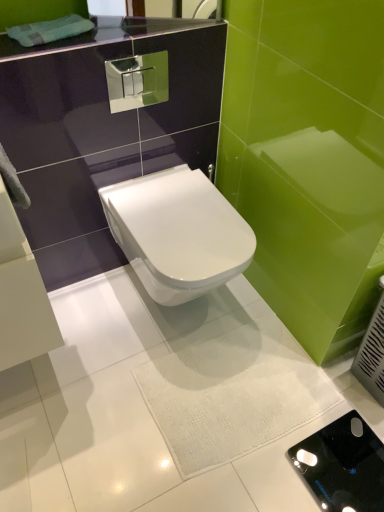
Question: From the image's perspective, is white glossy toilet at center positioned above or below black glossy porcelain at center?

Choices:
 (A) above
 (B) below

Answer: (A)

Question: Based on their positions, is white glossy toilet at center located to the left or right of black glossy porcelain at center?

Choices:
 (A) left
 (B) right

Answer: (A)

Question: Relative to black glossy porcelain at center, is white glossy toilet at center in front or behind?

Choices:
 (A) front
 (B) behind

Answer: (A)

Question: Considering the positions of black glossy porcelain at center and white glossy toilet at center in the image, is black glossy porcelain at center taller or shorter than white glossy toilet at center?

Choices:
 (A) short
 (B) tall

Answer: (A)

Question: Considering the positions of black glossy porcelain at center and white glossy toilet at center in the image, is black glossy porcelain at center wider or thinner than white glossy toilet at center?

Choices:
 (A) thin
 (B) wide

Answer: (A)

Question: Is black glossy porcelain at center bigger or smaller than white glossy toilet at center?

Choices:
 (A) small
 (B) big

Answer: (A)

Question: Do you think black glossy porcelain at center is within white glossy toilet at center, or outside of it?

Choices:
 (A) inside
 (B) outside

Answer: (B)